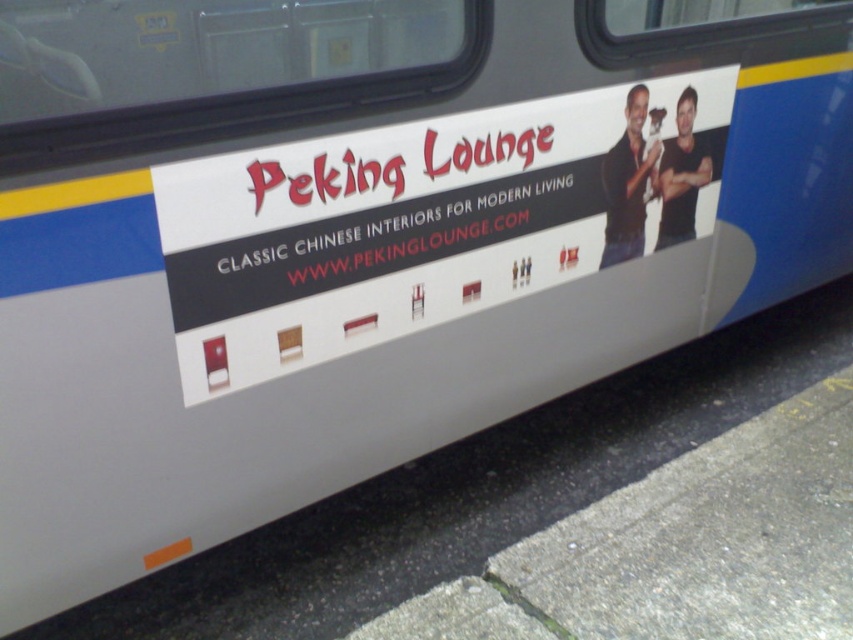
Measure the distance between white matte signboard at center and white matte text at center.

14.16 centimeters

Which is below, white matte signboard at center or white matte text at center?

Positioned lower is white matte signboard at center.

Which is in front, point (213, 332) or point (303, 243)?

Point (213, 332)

Find the location of a particular element. Image resolution: width=853 pixels, height=640 pixels. white matte signboard at center is located at coordinates (433, 224).